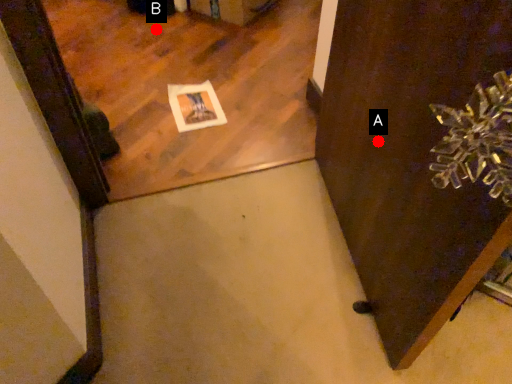
Question: Two points are circled on the image, labeled by A and B beside each circle. Which point appears farthest from the camera in this image?

Choices:
 (A) A is further
 (B) B is further

Answer: (B)